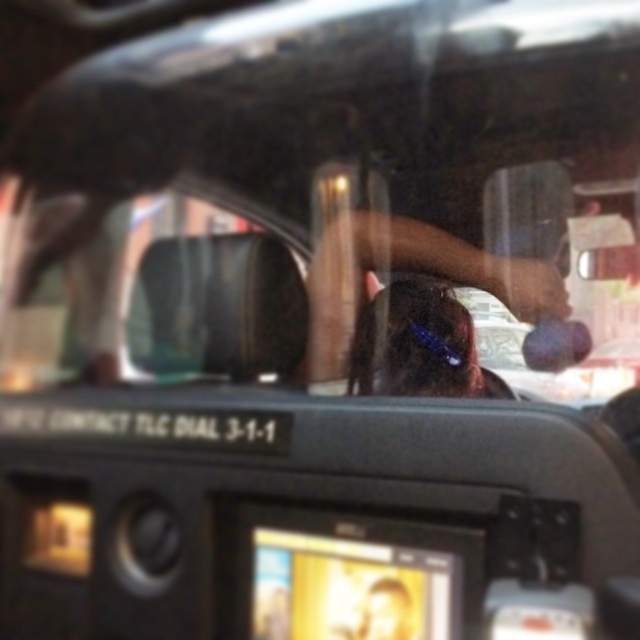
Is brown hair at center smaller than shiny blue hair at center?

No.

Based on the photo, who is more distant from viewer, [396,256] or [406,388]?

Positioned behind is point [396,256].

You are a GUI agent. You are given a task and a screenshot of the screen. Output one action in this format:
    pyautogui.click(x=<x>, y=<y>)
    Task: Click on the brown hair at center
    The image size is (640, 640).
    Given the screenshot: What is the action you would take?
    pyautogui.click(x=410, y=272)